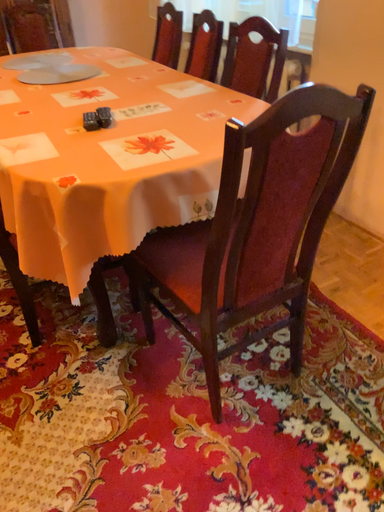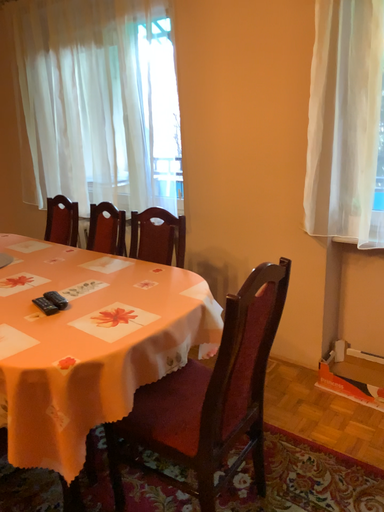
Question: Which way did the camera rotate in the video?

Choices:
 (A) rotated upward
 (B) rotated downward

Answer: (A)